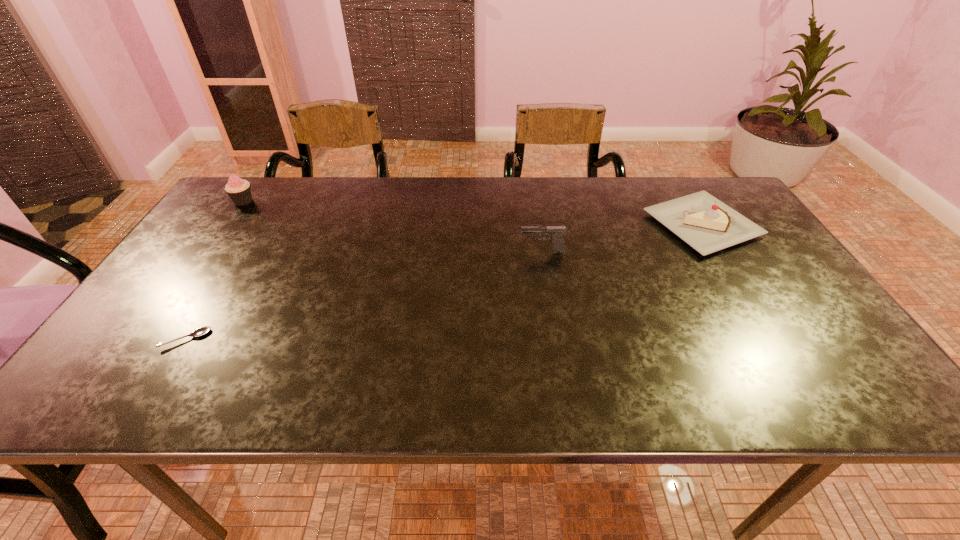
The image size is (960, 540). Identify the location of blank space at the near edge. (565, 374).

Locate an element on the screen. free region at the left edge of the desktop is located at coordinates (180, 315).

This screenshot has width=960, height=540. In order to click on free space at the far left corner of the desktop in this screenshot , I will do click(x=252, y=181).

At what (x,y) coordinates should I click in order to perform the action: click on blank space at the near left corner of the desktop. Please return your answer as a coordinate pair (x, y). Looking at the image, I should click on (147, 378).

You are a GUI agent. You are given a task and a screenshot of the screen. Output one action in this format:
    pyautogui.click(x=<x>, y=<y>)
    Task: Click on the vacant position at the near right corner of the desktop
    
    Given the screenshot: What is the action you would take?
    pyautogui.click(x=872, y=386)

Find the location of a particular element. The height and width of the screenshot is (540, 960). unoccupied area between the nearest object and the cupcake is located at coordinates (215, 270).

Locate an element on the screen. The height and width of the screenshot is (540, 960). vacant area that lies between the cupcake and the pistol is located at coordinates (393, 226).

I want to click on free space between the second shortest object and the shortest object, so click(444, 282).

Where is `vacant space that's between the cake and the leftmost object`? vacant space that's between the cake and the leftmost object is located at coordinates (472, 213).

The width and height of the screenshot is (960, 540). Identify the location of free spot between the pistol and the soupspoon. (364, 295).